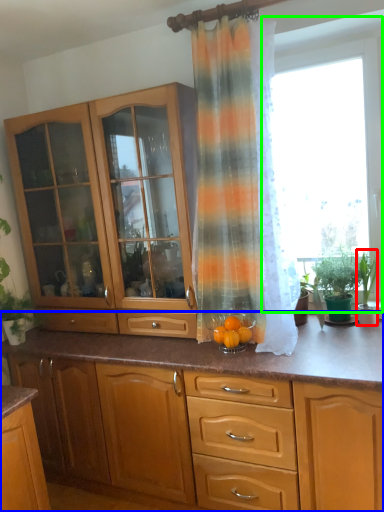
Question: Which is farther away from houseplant (highlighted by a red box)? cabinetry (highlighted by a blue box) or window screen (highlighted by a green box)?

Choices:
 (A) cabinetry
 (B) window screen

Answer: (A)